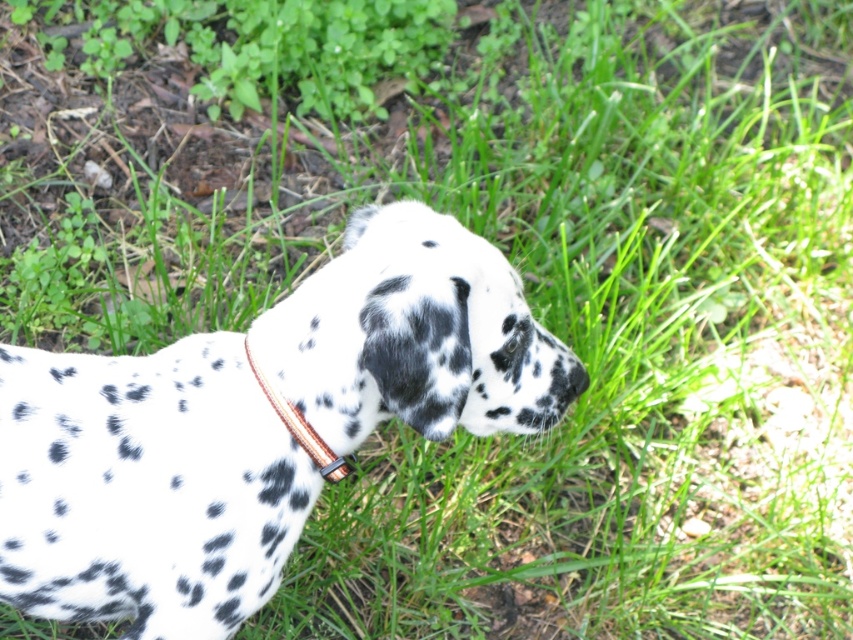
Question: Does spotted fur at center appear on the left side of brown leather collar at center?

Choices:
 (A) yes
 (B) no

Answer: (A)

Question: Observing the image, what is the correct spatial positioning of spotted fur at center in reference to brown leather collar at center?

Choices:
 (A) above
 (B) below

Answer: (B)

Question: Which object appears closest to the camera in this image?

Choices:
 (A) spotted fur at center
 (B) brown leather collar at center

Answer: (A)

Question: Is spotted fur at center in front of brown leather collar at center?

Choices:
 (A) yes
 (B) no

Answer: (A)

Question: Among these objects, which one is farthest from the camera?

Choices:
 (A) brown leather collar at center
 (B) spotted fur at center

Answer: (A)

Question: Among these points, which one is nearest to the camera?

Choices:
 (A) [392, 369]
 (B) [317, 458]

Answer: (A)